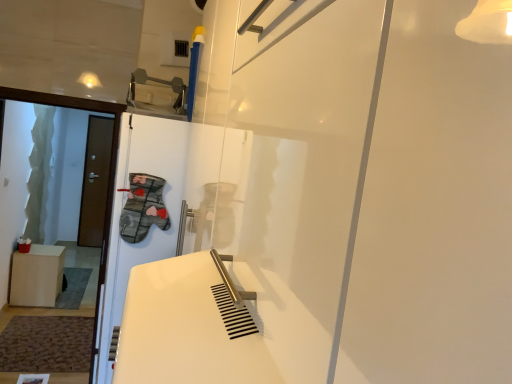
Image resolution: width=512 pixels, height=384 pixels. What do you see at coordinates (95, 181) in the screenshot?
I see `brown matte door at left` at bounding box center [95, 181].

You are a GUI agent. You are given a task and a screenshot of the screen. Output one action in this format:
    pyautogui.click(x=<x>, y=<y>)
    Task: Click on the brown matte door at left
    This screenshot has width=512, height=384.
    Given the screenshot: What is the action you would take?
    pyautogui.click(x=95, y=181)

Where is `light brown wooden cabinet at left`? light brown wooden cabinet at left is located at coordinates pyautogui.click(x=37, y=276).

Where is `brown matte door at left`? brown matte door at left is located at coordinates (95, 181).

Is point (98, 192) closer or farther from the camera than point (36, 262)?

Point (98, 192) is farther from the camera than point (36, 262).

Is brown matte door at left oriented towards light brown wooden cabinet at left?

Yes, brown matte door at left is aimed at light brown wooden cabinet at left.

From a real-world perspective, between brown matte door at left and light brown wooden cabinet at left, who is vertically higher?

From a 3D spatial view, brown matte door at left is above.

In the image, is white matte screen door at center positioned in front of or behind light brown wooden cabinet at left?

white matte screen door at center is positioned closer to the viewer than light brown wooden cabinet at left.

From the image's perspective, is white matte screen door at center under light brown wooden cabinet at left?

No.

How many degrees apart are the facing directions of white matte screen door at center and light brown wooden cabinet at left?

180 degrees separate the facing orientations of white matte screen door at center and light brown wooden cabinet at left.

Is light brown wooden cabinet at left positioned with its back to white matte screen door at center?

light brown wooden cabinet at left is not turned away from white matte screen door at center.

Does point (49, 261) come closer to viewer compared to point (114, 266)?

No, it is behind (114, 266).

The width and height of the screenshot is (512, 384). What are the coordinates of `screen door above the light brown wooden cabinet at left (from a real-world perspective)` in the screenshot? It's located at (125, 203).

Considering the relative positions of light brown wooden cabinet at left and white matte screen door at center in the image provided, is light brown wooden cabinet at left to the right of white matte screen door at center from the viewer's perspective?

No, light brown wooden cabinet at left is not to the right of white matte screen door at center.

Considering their positions, is light brown wooden cabinet at left located in front of or behind brown matte door at left?

light brown wooden cabinet at left is in front of brown matte door at left.

Who is taller, light brown wooden cabinet at left or brown matte door at left?

brown matte door at left is taller.

From the image's perspective, between light brown wooden cabinet at left and brown matte door at left, which one is located above?

brown matte door at left.

Which of these two, light brown wooden cabinet at left or brown matte door at left, is thinner?

brown matte door at left is thinner.

Is white matte screen door at center thinner than brown matte door at left?

Incorrect, the width of white matte screen door at center is not less than that of brown matte door at left.

From the image's perspective, which object appears higher, white matte screen door at center or brown matte door at left?

brown matte door at left, from the image's perspective.

Which is correct: white matte screen door at center is inside brown matte door at left, or outside of it?

white matte screen door at center lies outside brown matte door at left.

Is white matte screen door at center touching brown matte door at left?

There is a gap between white matte screen door at center and brown matte door at left.

Is the position of brown matte door at left less distant than that of white matte screen door at center?

No, it is behind white matte screen door at center.

From the image's perspective, is brown matte door at left above or below white matte screen door at center?

brown matte door at left is situated higher than white matte screen door at center in the image.

I want to click on door above the white matte screen door at center (from the image's perspective), so click(95, 181).

Considering the sizes of objects brown matte door at left and white matte screen door at center in the image provided, who is thinner, brown matte door at left or white matte screen door at center?

brown matte door at left is thinner.

Image resolution: width=512 pixels, height=384 pixels. In order to click on furniture that appears on the right of brown matte door at left in this screenshot , I will do `click(37, 276)`.

You are a GUI agent. You are given a task and a screenshot of the screen. Output one action in this format:
    pyautogui.click(x=<x>, y=<y>)
    Task: Click on the furniture behind the white matte screen door at center
    
    Given the screenshot: What is the action you would take?
    pyautogui.click(x=37, y=276)

Looking at the image, which one is located closer to white matte screen door at center, brown matte door at left or light brown wooden cabinet at left?

→ light brown wooden cabinet at left is closer to white matte screen door at center.

Based on their spatial positions, is light brown wooden cabinet at left or white matte screen door at center closer to brown matte door at left?

light brown wooden cabinet at left is closer to brown matte door at left.

Looking at this image, based on their spatial positions, is brown matte door at left or white matte screen door at center closer to light brown wooden cabinet at left?

brown matte door at left is positioned closer to the anchor light brown wooden cabinet at left.

In the scene shown: Looking at the image, which one is located further to brown matte door at left, white matte screen door at center or light brown wooden cabinet at left?

Based on the image, white matte screen door at center appears to be further to brown matte door at left.

Based on their spatial positions, is light brown wooden cabinet at left or brown matte door at left closer to white matte screen door at center?

light brown wooden cabinet at left.

Estimate the real-world distances between objects in this image. Which object is further from light brown wooden cabinet at left, white matte screen door at center or brown matte door at left?

white matte screen door at center is further to light brown wooden cabinet at left.

Image resolution: width=512 pixels, height=384 pixels. I want to click on furniture between white matte screen door at center and brown matte door at left along the z-axis, so click(x=37, y=276).